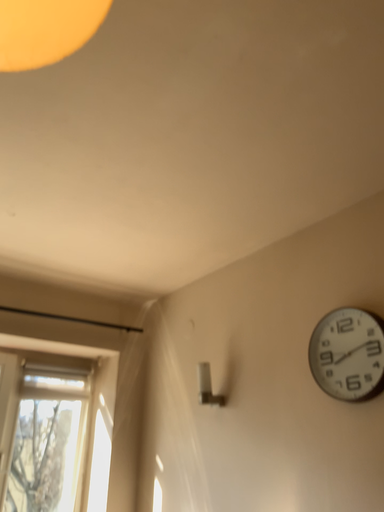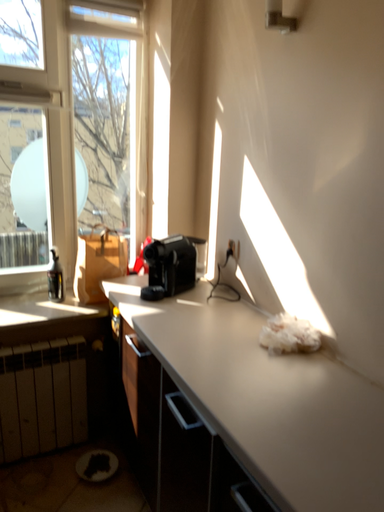
Question: Which way did the camera rotate in the video?

Choices:
 (A) rotated right
 (B) rotated left

Answer: (B)